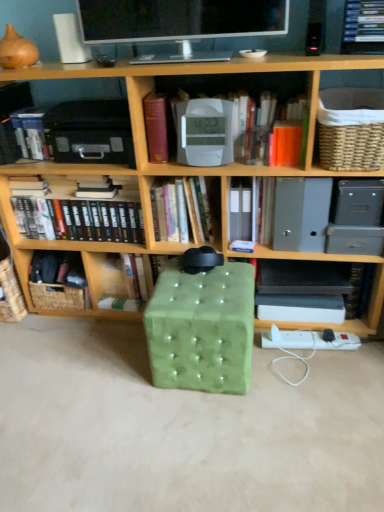
Where is `free space between wooden bookshelf at center and green velvet ottoman at center`? This screenshot has height=512, width=384. free space between wooden bookshelf at center and green velvet ottoman at center is located at coordinates (144, 347).